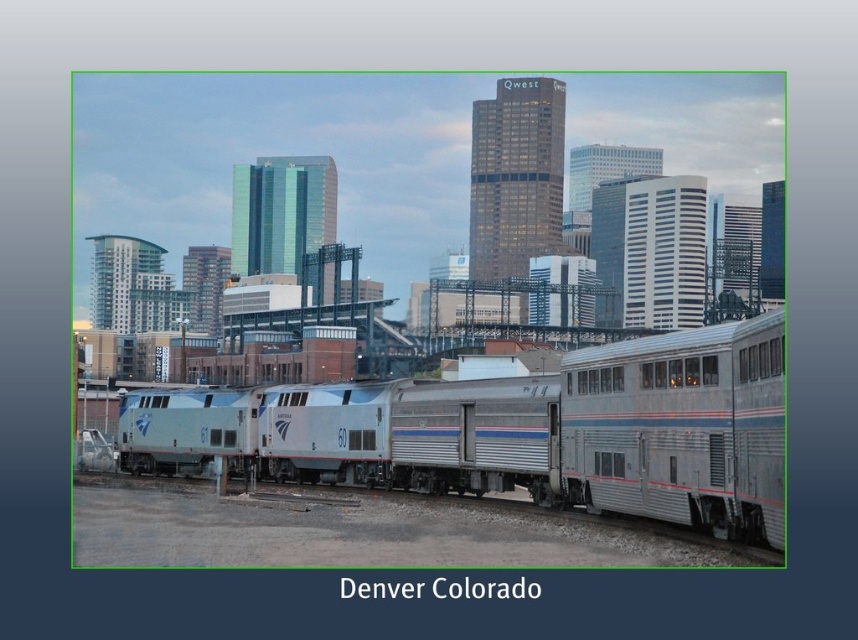
Question: Can you confirm if silver metallic train at center is smaller than silver metallic train car at center?

Choices:
 (A) no
 (B) yes

Answer: (A)

Question: Which point is closer to the camera?

Choices:
 (A) silver metallic train car at center
 (B) silver metallic train at center

Answer: (B)

Question: Can you confirm if silver metallic train at center is wider than silver metallic train car at center?

Choices:
 (A) no
 (B) yes

Answer: (B)

Question: Can you confirm if silver metallic train at center is smaller than silver metallic train car at center?

Choices:
 (A) no
 (B) yes

Answer: (A)